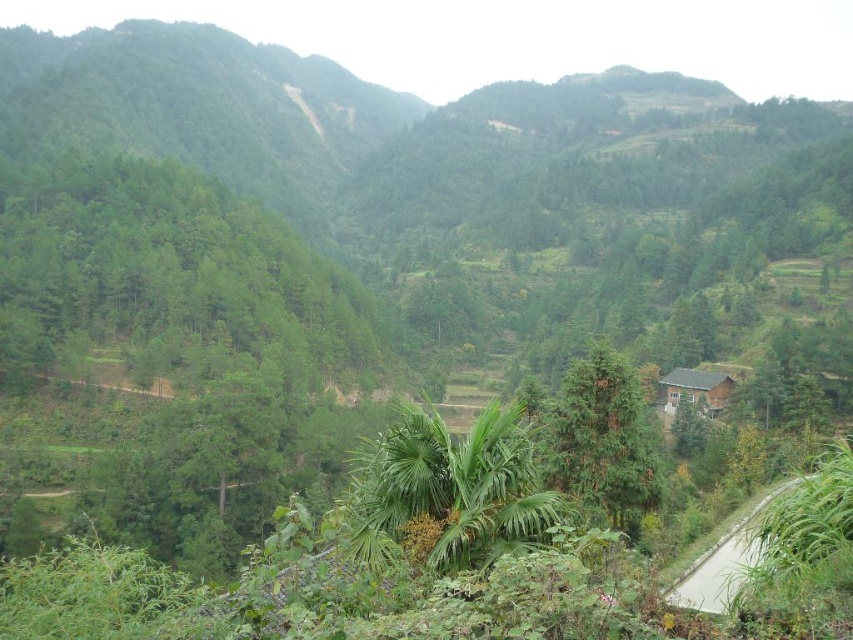
Question: Which point is farther to the camera?

Choices:
 (A) green leafy palm at center
 (B) brown wooden hut at center-right

Answer: (B)

Question: Does green matte tree at center have a greater width compared to brown wooden hut at center-right?

Choices:
 (A) yes
 (B) no

Answer: (A)

Question: Among these points, which one is nearest to the camera?

Choices:
 (A) (724, 381)
 (B) (393, 428)
 (C) (541, 435)

Answer: (B)

Question: Which object is closer to the camera taking this photo?

Choices:
 (A) brown wooden hut at center-right
 (B) green matte tree at center

Answer: (B)

Question: Does green matte tree at center appear over brown wooden hut at center-right?

Choices:
 (A) yes
 (B) no

Answer: (A)

Question: Can you confirm if green leafy palm at center is thinner than green matte tree at center?

Choices:
 (A) no
 (B) yes

Answer: (B)